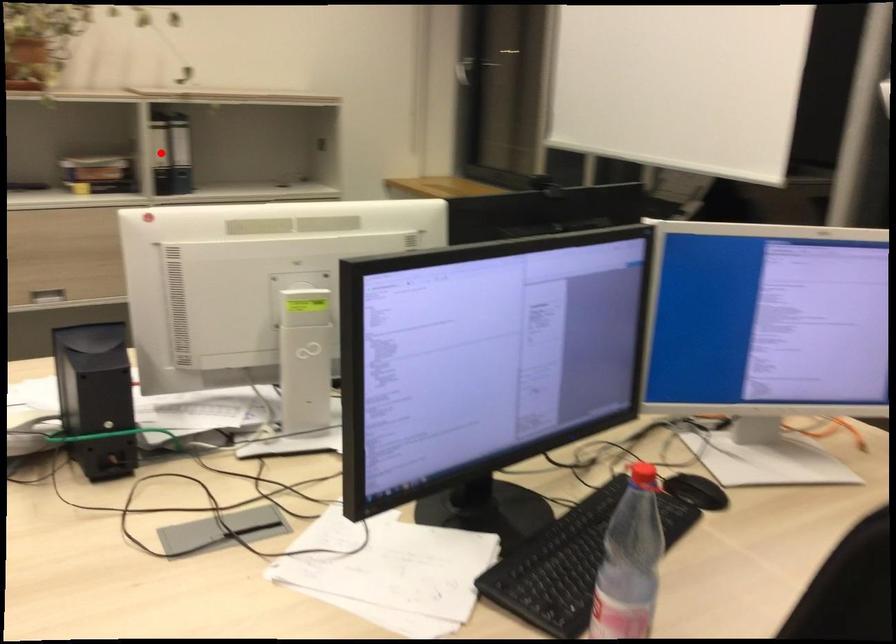
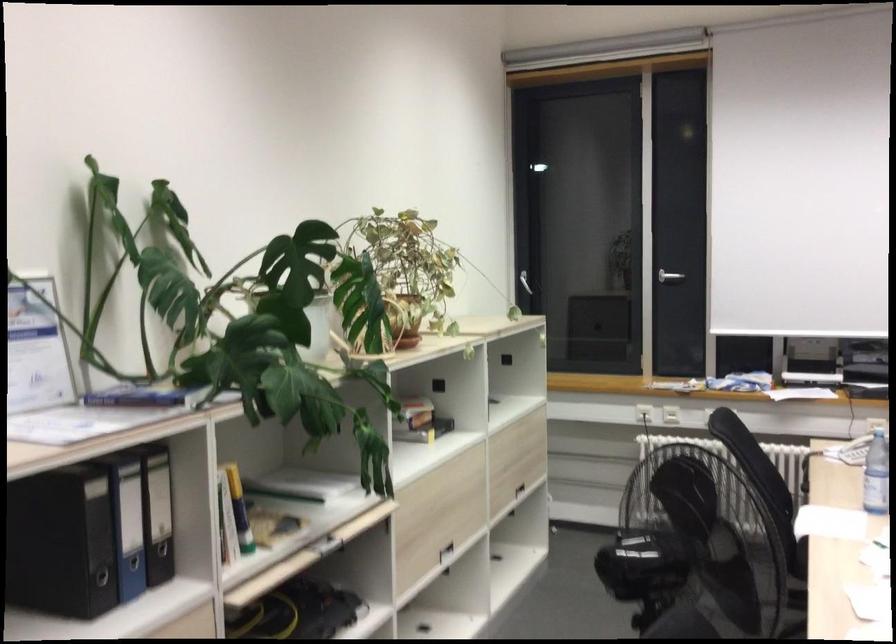
Question: I am providing you with two images of the same scene from different viewpoints. A red point is marked on the first image. At the location where the point appears in image 1, is it still visible in image 2?

Choices:
 (A) Yes
 (B) No

Answer: (B)